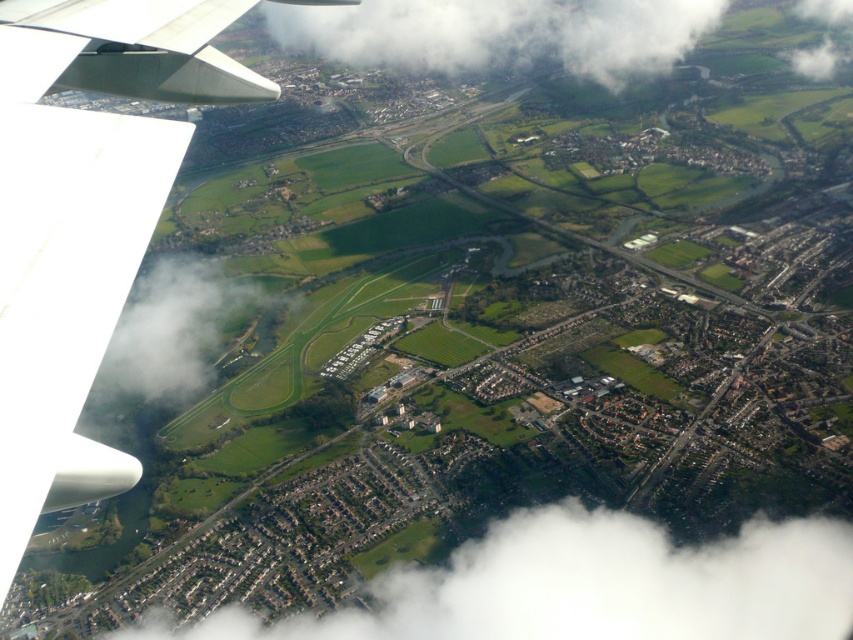
Question: Among these points, which one is nearest to the camera?

Choices:
 (A) (399, 570)
 (B) (170, 324)
 (C) (132, 116)
 (D) (444, 1)

Answer: (C)

Question: Based on their relative distances, which object is farther from the white fluffy cloud at center?

Choices:
 (A) white fluffy cloud at lower center
 (B) green grass at lower left
 (C) white matte wing at upper left

Answer: (C)

Question: Which of the following is the closest to the observer?

Choices:
 (A) white fluffy cloud at lower center
 (B) green grass at lower left
 (C) white fluffy cloud at center

Answer: (A)

Question: Does white fluffy cloud at center appear on the right side of green grass at lower left?

Choices:
 (A) no
 (B) yes

Answer: (B)

Question: Can you confirm if white matte wing at upper left is positioned to the left of white fluffy cloud at lower center?

Choices:
 (A) yes
 (B) no

Answer: (A)

Question: Does white fluffy cloud at center come behind green grass at lower left?

Choices:
 (A) no
 (B) yes

Answer: (B)